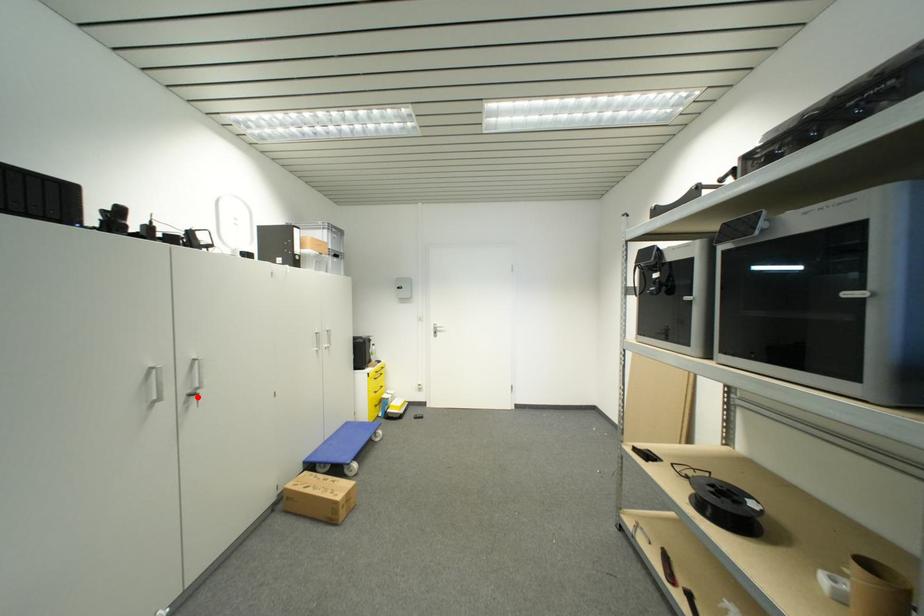
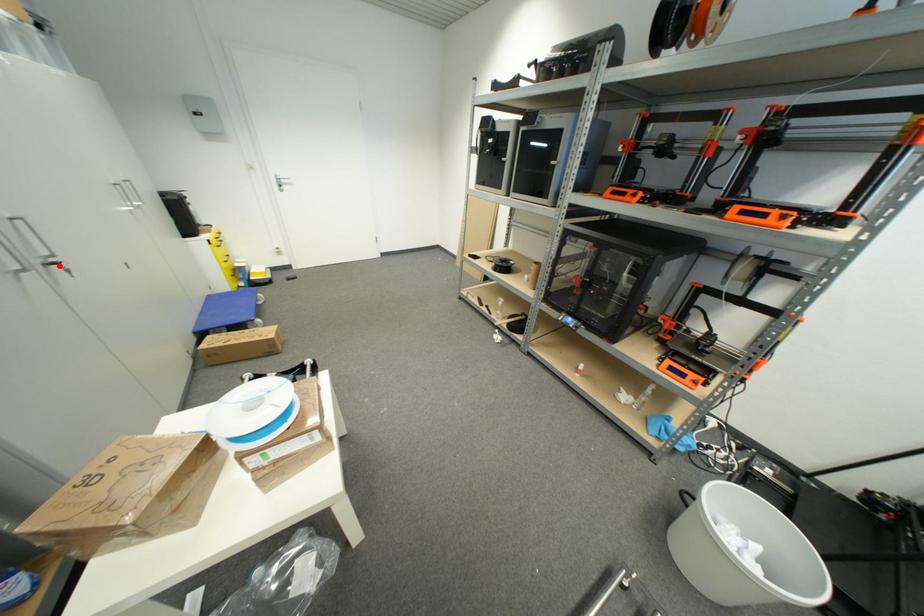
I am providing you with two images of the same scene from different viewpoints. A red point is marked on the first image and another point is marked on the second image. Do the highlighted points in image1 and image2 indicate the same real-world spot?

Yes